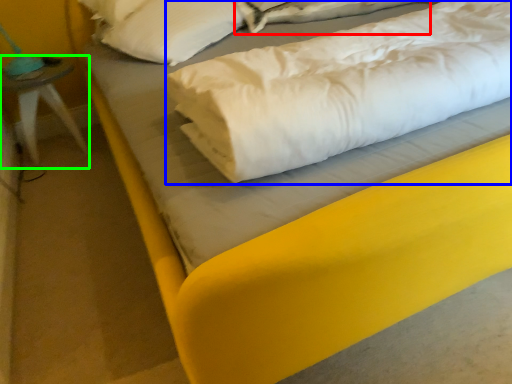
Question: Based on their relative distances, which object is farther from sheet (highlighted by a red box)? Choose from linen (highlighted by a blue box) and furniture (highlighted by a green box).

Choices:
 (A) linen
 (B) furniture

Answer: (B)